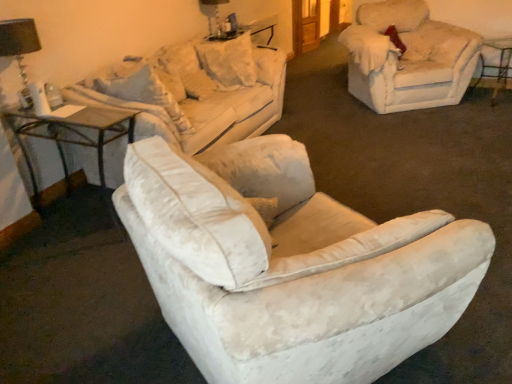
How much space does black fabric lampshade at upper left, which is counted as the 2th table lamp, starting from the back, occupy horizontally?

10.75 inches.

What is the approximate height of white velvety pillow at center, the 2th pillow when ordered from left to right?

white velvety pillow at center, the 2th pillow when ordered from left to right, is 26.01 inches tall.

The height and width of the screenshot is (384, 512). I want to click on metallic silver bar stool at right, so click(x=496, y=65).

This screenshot has height=384, width=512. What do you see at coordinates (496, 65) in the screenshot?
I see `metallic silver bar stool at right` at bounding box center [496, 65].

Where is `wooden glass table at left`? This screenshot has width=512, height=384. wooden glass table at left is located at coordinates (74, 133).

The height and width of the screenshot is (384, 512). Find the location of `matte black table lamp at upper center, the 1th table lamp viewed from the back`. matte black table lamp at upper center, the 1th table lamp viewed from the back is located at coordinates (213, 16).

The width and height of the screenshot is (512, 384). Find the location of `black fabric lampshade at upper left, which is counted as the 2th table lamp, starting from the back`. black fabric lampshade at upper left, which is counted as the 2th table lamp, starting from the back is located at coordinates [x=18, y=37].

Considering the sizes of objects matte black table lamp at upper center, the 1th table lamp viewed from the back, and white velvety pillow at center, the 2th pillow when ordered from left to right, in the image provided, who is wider, matte black table lamp at upper center, the 1th table lamp viewed from the back, or white velvety pillow at center, the 2th pillow when ordered from left to right,?

white velvety pillow at center, the 2th pillow when ordered from left to right.

Can you confirm if matte black table lamp at upper center, marked as the second table lamp in a bottom-to-top arrangement, is smaller than white velvety pillow at center, the 2th pillow when ordered from left to right?

Yes, matte black table lamp at upper center, marked as the second table lamp in a bottom-to-top arrangement, is smaller than white velvety pillow at center, the 2th pillow when ordered from left to right.

Choose the correct answer: Is matte black table lamp at upper center, the 1th table lamp viewed from the back, inside white velvety pillow at center, the first pillow when ordered from right to left, or outside it?

matte black table lamp at upper center, the 1th table lamp viewed from the back, lies outside white velvety pillow at center, the first pillow when ordered from right to left.

Based on the photo, from a real-world perspective, is matte black table lamp at upper center, which ranks as the first table lamp in right-to-left order, below white velvety pillow at center, the first pillow when ordered from right to left?

Incorrect, from a real-world perspective, matte black table lamp at upper center, which ranks as the first table lamp in right-to-left order, is higher than white velvety pillow at center, the first pillow when ordered from right to left.

How many degrees apart are the facing directions of black fabric lampshade at upper left, the 2th table lamp when ordered from right to left, and matte black table lamp at upper center, the 1th table lamp viewed from the back?

The facing directions of black fabric lampshade at upper left, the 2th table lamp when ordered from right to left, and matte black table lamp at upper center, the 1th table lamp viewed from the back, are 0.00442 degrees apart.

Is black fabric lampshade at upper left, the 2th table lamp in the top-to-bottom sequence, further to camera compared to matte black table lamp at upper center, marked as the second table lamp in a bottom-to-top arrangement?

No.

This screenshot has height=384, width=512. I want to click on table lamp lying on the right of black fabric lampshade at upper left, the 2th table lamp when ordered from right to left, so pos(213,16).

Considering the sizes of objects black fabric lampshade at upper left, arranged as the 1th table lamp when viewed from the front, and matte black table lamp at upper center, positioned as the 1th table lamp in top-to-bottom order, in the image provided, who is shorter, black fabric lampshade at upper left, arranged as the 1th table lamp when viewed from the front, or matte black table lamp at upper center, positioned as the 1th table lamp in top-to-bottom order,?

Standing shorter between the two is matte black table lamp at upper center, positioned as the 1th table lamp in top-to-bottom order.

Is black fabric lampshade at upper left, the 2th table lamp in the top-to-bottom sequence, surrounded by fuzzy beige chair at upper right?

No.

How far apart are fuzzy beige chair at upper right and black fabric lampshade at upper left, placed as the first table lamp when sorted from left to right?

11.00 feet.

Is fuzzy beige chair at upper right thinner than black fabric lampshade at upper left, the 1th table lamp from the bottom?

In fact, fuzzy beige chair at upper right might be wider than black fabric lampshade at upper left, the 1th table lamp from the bottom.

Does fuzzy beige chair at upper right come behind black fabric lampshade at upper left, arranged as the 1th table lamp when viewed from the front?

Yes, it is.

From a real-world perspective, is velvet beige couch at upper left above or below white velvety pillow at center, the 2th pillow when ordered from left to right?

Clearly, from a real-world perspective, velvet beige couch at upper left is above white velvety pillow at center, the 2th pillow when ordered from left to right.

How far apart are velvet beige couch at upper left and white velvety pillow at center, the 2th pillow when ordered from left to right?

velvet beige couch at upper left is 14.86 inches away from white velvety pillow at center, the 2th pillow when ordered from left to right.

Is velvet beige couch at upper left taller than white velvety pillow at center, the 2th pillow when ordered from left to right?

Indeed, velvet beige couch at upper left has a greater height compared to white velvety pillow at center, the 2th pillow when ordered from left to right.

Is velvet beige couch at upper left not close to white velvety pillow at center, the first pillow when ordered from right to left?

No, velvet beige couch at upper left is not far away from white velvety pillow at center, the first pillow when ordered from right to left.

Can you confirm if fuzzy beige chair at upper right is bigger than velvet beige couch at upper left?

Correct, fuzzy beige chair at upper right is larger in size than velvet beige couch at upper left.

Which object is closer to the camera taking this photo, fuzzy beige chair at upper right or velvet beige couch at upper left?

velvet beige couch at upper left is more forward.

Between fuzzy beige chair at upper right and velvet beige couch at upper left, which one appears on the right side from the viewer's perspective?

fuzzy beige chair at upper right.

Are velvet beige couch at upper left and fuzzy beige chair at upper right far apart?

That's right, there is a large distance between velvet beige couch at upper left and fuzzy beige chair at upper right.

In the scene shown: Who is shorter, velvet beige couch at upper left or fuzzy beige chair at upper right?

Standing shorter between the two is velvet beige couch at upper left.

Considering the sizes of objects velvet beige couch at upper left and fuzzy beige chair at upper right in the image provided, who is bigger, velvet beige couch at upper left or fuzzy beige chair at upper right?

fuzzy beige chair at upper right is bigger.

Is white velvety pillow at center, the 2th pillow when ordered from left to right, directly adjacent to wooden glass table at left?

There is a gap between white velvety pillow at center, the 2th pillow when ordered from left to right, and wooden glass table at left.

Is white velvety pillow at center, the 2th pillow when ordered from left to right, bigger than wooden glass table at left?

No.

From a real-world perspective, is white velvety pillow at center, the first pillow when ordered from right to left, located higher than wooden glass table at left?

Yes.

Is the depth of white velvety pillow at center, the first pillow when ordered from right to left, greater than that of wooden glass table at left?

Yes.

Image resolution: width=512 pixels, height=384 pixels. I want to click on the 1st pillow positioned below the matte black table lamp at upper center, positioned as the second table lamp in left-to-right order (from the image's perspective), so click(x=229, y=62).

This screenshot has width=512, height=384. I want to click on table lamp above the black fabric lampshade at upper left, the 2th table lamp in the top-to-bottom sequence (from the image's perspective), so click(x=213, y=16).

Based on their spatial positions, is white velvety pillow at center, the 2th pillow when ordered from left to right, or metallic silver bar stool at right further from black fabric lampshade at upper left, the 1th table lamp from the bottom?

metallic silver bar stool at right is further to black fabric lampshade at upper left, the 1th table lamp from the bottom.

Based on the photo, estimate the real-world distances between objects in this image. Which object is further from velvet beige couch at upper left, fuzzy beige chair at upper right or metallic silver bar stool at right?

metallic silver bar stool at right lies further to velvet beige couch at upper left than the other object.

Looking at the image, which one is located closer to fuzzy beige chair at upper right, matte black table lamp at upper center, the 2th table lamp viewed from the front, or black fabric lampshade at upper left, placed as the first table lamp when sorted from left to right?

matte black table lamp at upper center, the 2th table lamp viewed from the front, lies closer to fuzzy beige chair at upper right than the other object.

Estimate the real-world distances between objects in this image. Which object is further from fuzzy beige chair at upper right, metallic silver bar stool at right or velvet beige couch at upper left?

The object further to fuzzy beige chair at upper right is velvet beige couch at upper left.

Based on their spatial positions, is metallic silver bar stool at right or white velvety pillow at center, the 2th pillow when ordered from left to right, further from velvet beige couch at upper left?

metallic silver bar stool at right.

Consider the image. Estimate the real-world distances between objects in this image. Which object is closer to black fabric lampshade at upper left, which is counted as the 2th table lamp, starting from the back, velvet beige couch at upper left or matte black table lamp at upper center, the 2th table lamp viewed from the front?

velvet beige couch at upper left is closer to black fabric lampshade at upper left, which is counted as the 2th table lamp, starting from the back.

Considering their positions, is velvet beige couch at upper left positioned further to fuzzy beige chair at upper right than matte black table lamp at upper center, which ranks as the first table lamp in right-to-left order?

Based on the image, matte black table lamp at upper center, which ranks as the first table lamp in right-to-left order, appears to be further to fuzzy beige chair at upper right.

From the image, which object appears to be farther from black fabric lampshade at upper left, which is counted as the 2th table lamp, starting from the back, white velvety pillow at center, the first pillow when ordered from right to left, or fuzzy beige chair at upper right?

Among the two, fuzzy beige chair at upper right is located further to black fabric lampshade at upper left, which is counted as the 2th table lamp, starting from the back.

Find the location of a particular element. Image resolution: width=512 pixels, height=384 pixels. table lamp between velvet beige couch at upper left and fuzzy beige chair at upper right in the horizontal direction is located at coordinates (213, 16).

Find the location of `pillow located between matte black table lamp at upper center, positioned as the 1th table lamp in top-to-bottom order, and metallic silver bar stool at right in the left-right direction`. pillow located between matte black table lamp at upper center, positioned as the 1th table lamp in top-to-bottom order, and metallic silver bar stool at right in the left-right direction is located at coordinates point(229,62).

At what (x,y) coordinates should I click in order to perform the action: click on studio couch located between black fabric lampshade at upper left, the 2th table lamp when ordered from right to left, and white velvety pillow at center, the first pillow when ordered from right to left, in the depth direction. Please return your answer as a coordinate pair (x, y). The image size is (512, 384). Looking at the image, I should click on (195, 90).

Identify the location of table lamp between wooden glass table at left and matte black table lamp at upper center, which ranks as the first table lamp in right-to-left order, in the front-back direction. (18, 37).